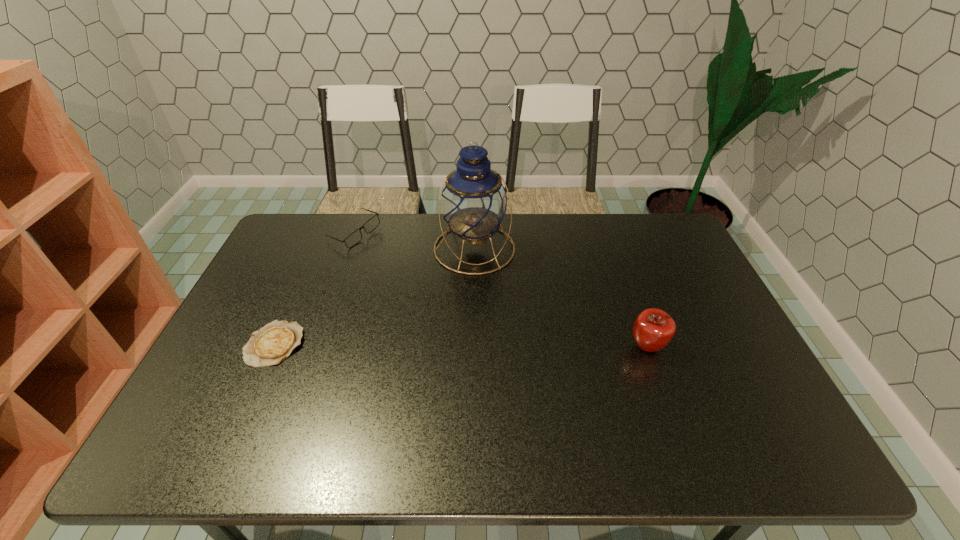
In the image, there is a desktop. Where is `vacant space at the right edge`? vacant space at the right edge is located at coordinates (677, 335).

Where is `free space at the far left corner of the desktop`? This screenshot has width=960, height=540. free space at the far left corner of the desktop is located at coordinates (315, 215).

You are a GUI agent. You are given a task and a screenshot of the screen. Output one action in this format:
    pyautogui.click(x=<x>, y=<y>)
    Task: Click on the free space at the far right corner of the desktop
    The height and width of the screenshot is (540, 960).
    Given the screenshot: What is the action you would take?
    pyautogui.click(x=659, y=232)

Find the location of a particular element. vacant area between the spectacles and the rightmost object is located at coordinates (x=500, y=290).

In order to click on free point between the apple and the spectacles in this screenshot , I will do `click(500, 290)`.

Identify the location of vacant region between the second tallest object and the tallest object. (561, 298).

You are a GUI agent. You are given a task and a screenshot of the screen. Output one action in this format:
    pyautogui.click(x=<x>, y=<y>)
    Task: Click on the free space between the apple and the spectacles
    
    Given the screenshot: What is the action you would take?
    pyautogui.click(x=500, y=290)

Locate an element on the screen. This screenshot has width=960, height=540. free spot between the lantern and the quiche is located at coordinates (374, 296).

Where is `vacant area between the second tallest object and the shortest object`? vacant area between the second tallest object and the shortest object is located at coordinates (461, 346).

You are a GUI agent. You are given a task and a screenshot of the screen. Output one action in this format:
    pyautogui.click(x=<x>, y=<y>)
    Task: Click on the vacant space that is in between the third tallest object and the third object from left to right
    
    Given the screenshot: What is the action you would take?
    pyautogui.click(x=415, y=241)